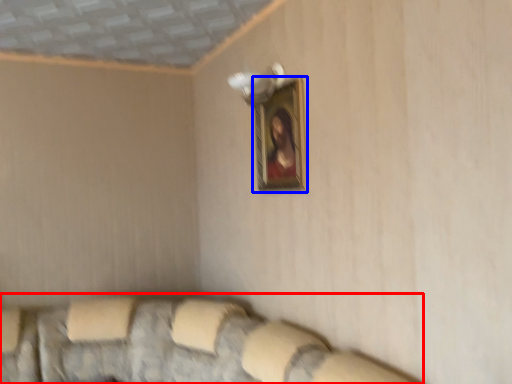
Question: Which object appears farthest to the camera in this image, couch (highlighted by a red box) or picture frame (highlighted by a blue box)?

Choices:
 (A) couch
 (B) picture frame

Answer: (B)